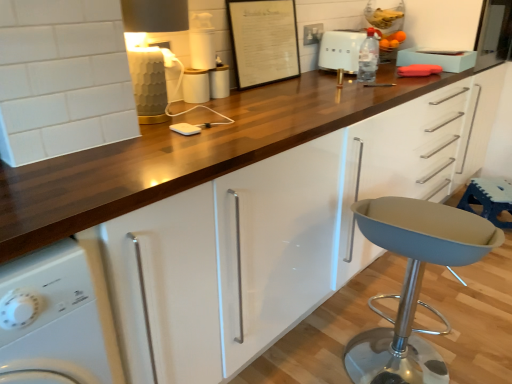
Where is `vacant space that is to the left of matte gray stool at lower right`? The image size is (512, 384). vacant space that is to the left of matte gray stool at lower right is located at coordinates (305, 353).